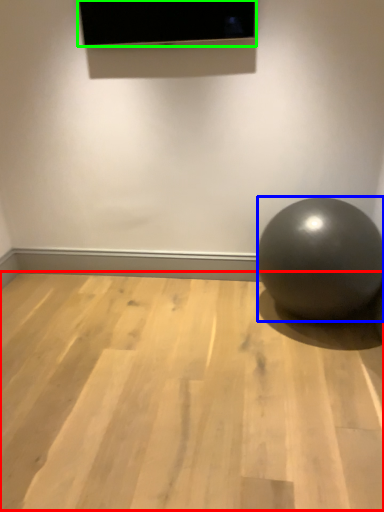
Question: Based on their relative distances, which object is nearer to surface (highlighted by a red box)? Choose from ball (highlighted by a blue box) and projection screen (highlighted by a green box).

Choices:
 (A) ball
 (B) projection screen

Answer: (A)